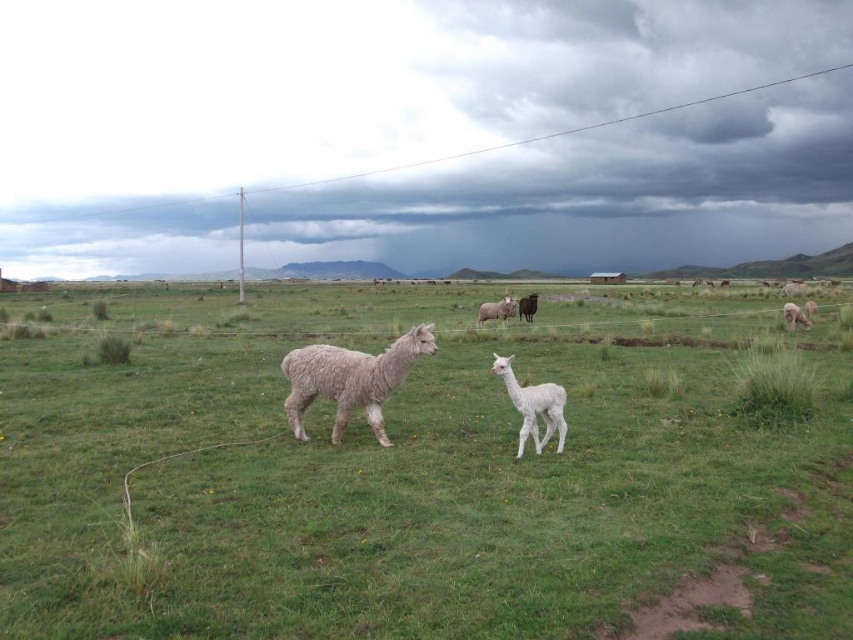
Which is more to the right, green soft grass at center or cloudy sky at upper center?

Positioned to the right is cloudy sky at upper center.

Does green soft grass at center appear on the right side of cloudy sky at upper center?

In fact, green soft grass at center is to the left of cloudy sky at upper center.

Who is more distant from viewer, (x=560, y=504) or (x=585, y=29)?

The point (x=585, y=29) is more distant.

Identify the location of green soft grass at center. The height and width of the screenshot is (640, 853). (410, 472).

Does point (416, 42) lie in front of point (554, 419)?

No, it is behind (554, 419).

Does cloudy sky at upper center lie behind white woolly alpaca at center?

Yes, it is.

Identify the location of cloudy sky at upper center. (422, 132).

I want to click on cloudy sky at upper center, so click(422, 132).

Who is higher up, green soft grass at center or fuzzy white alpaca at center?

green soft grass at center is higher up.

Between green soft grass at center and fuzzy white alpaca at center, which one appears on the right side from the viewer's perspective?

From the viewer's perspective, fuzzy white alpaca at center appears more on the right side.

Which is in front, point (227, 509) or point (337, 403)?

Positioned in front is point (227, 509).

Locate an element on the screen. The image size is (853, 640). green soft grass at center is located at coordinates (410, 472).